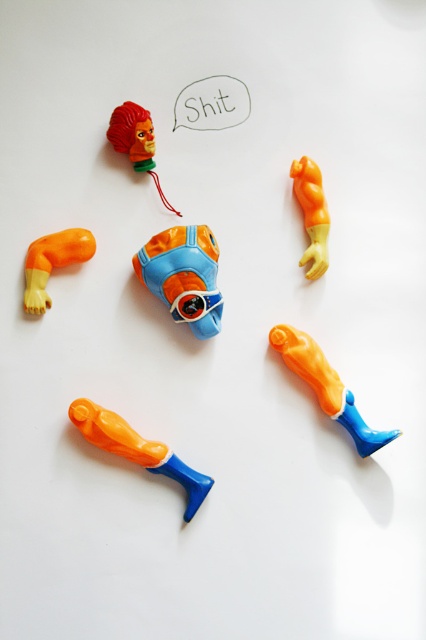
Question: Which point is closer to the camera taking this photo?

Choices:
 (A) (120, 115)
 (B) (178, 280)
 (C) (348, 392)
 (D) (83, 403)

Answer: (D)

Question: Is orange matte toy at lower left to the left of matte plastic head at upper left from the viewer's perspective?

Choices:
 (A) yes
 (B) no

Answer: (A)

Question: Estimate the real-world distances between objects in this image. Which object is closer to the orange matte plastic man at lower right?

Choices:
 (A) orange matte plastic arm at upper left
 (B) orange matte plastic arm at upper center
 (C) matte plastic toy head at center

Answer: (C)

Question: Which point is farther to the camera?

Choices:
 (A) matte plastic head at upper left
 (B) orange matte plastic man at lower right

Answer: (A)

Question: Is the position of orange matte toy at lower left more distant than that of orange matte plastic arm at upper center?

Choices:
 (A) yes
 (B) no

Answer: (B)

Question: Does orange matte toy at lower left appear on the right side of matte plastic head at upper left?

Choices:
 (A) yes
 (B) no

Answer: (B)